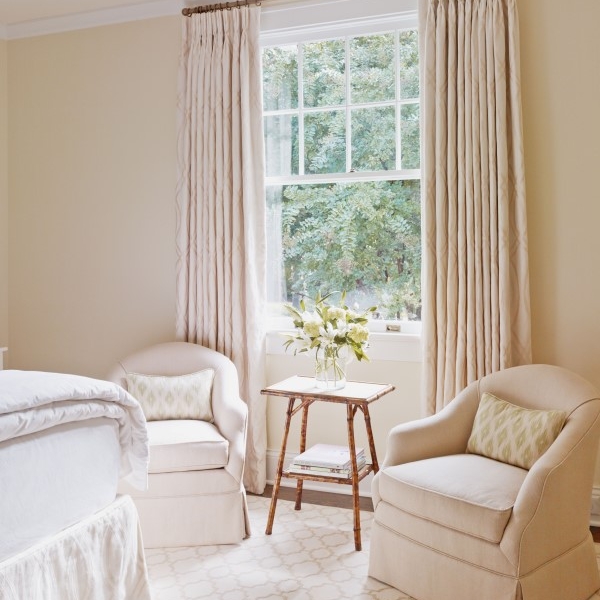
In order to click on ceiling in this screenshot , I will do `click(25, 5)`.